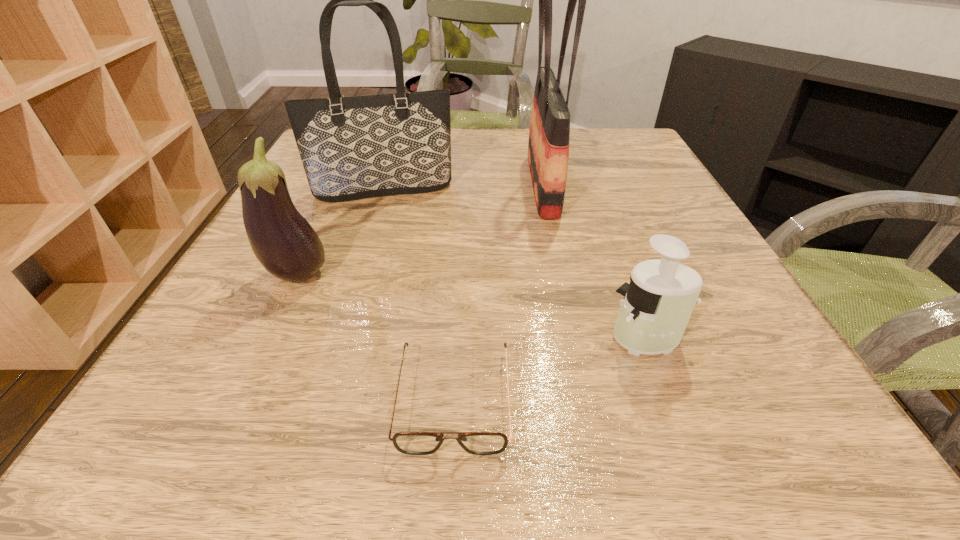
I want to click on free space located 0.140m on the front of the tote bag, so click(x=367, y=245).

Locate an element on the screen. The image size is (960, 540). free location located 0.250m on the front of the third nearest object is located at coordinates (221, 438).

Where is `free space located 0.120m on the back of the rightmost object`? This screenshot has height=540, width=960. free space located 0.120m on the back of the rightmost object is located at coordinates (621, 269).

Identify the location of object that is positioned at the far edge. (548, 149).

This screenshot has height=540, width=960. Find the location of `object that is positioned at the near edge`. object that is positioned at the near edge is located at coordinates (413, 443).

The image size is (960, 540). Identify the location of tote bag that is at the left edge. (357, 147).

Image resolution: width=960 pixels, height=540 pixels. Identify the location of eggplant positioned at the left edge. (283, 241).

Where is `object situated at the right edge`? This screenshot has width=960, height=540. object situated at the right edge is located at coordinates (657, 305).

In the image, there is a desktop. Where is `free space at the far edge`? free space at the far edge is located at coordinates (459, 164).

Where is `vacant area at the left edge of the desktop`? The height and width of the screenshot is (540, 960). vacant area at the left edge of the desktop is located at coordinates (339, 226).